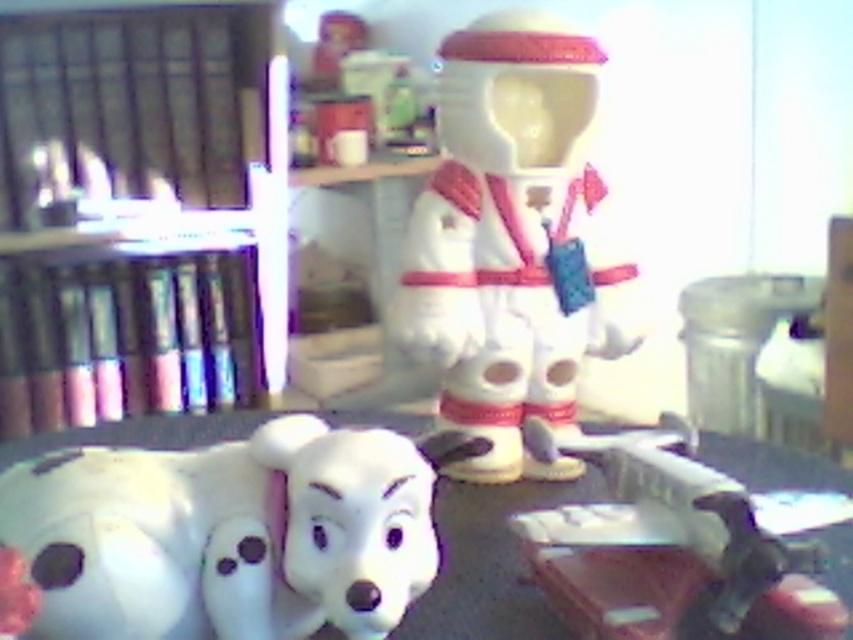
Who is positioned more to the right, metallic black bookshelf at left or white glossy astronaut at center?

white glossy astronaut at center

Between point (19, 216) and point (541, 176), which one is positioned behind?

The point (19, 216) is more distant.

Locate an element on the screen. This screenshot has height=640, width=853. metallic black bookshelf at left is located at coordinates (140, 211).

Does metallic black bookshelf at left appear on the left side of white plastic table at lower center?

Yes, metallic black bookshelf at left is to the left of white plastic table at lower center.

Can you confirm if metallic black bookshelf at left is wider than white plastic table at lower center?

No, metallic black bookshelf at left is not wider than white plastic table at lower center.

Image resolution: width=853 pixels, height=640 pixels. Describe the element at coordinates (140, 211) in the screenshot. I see `metallic black bookshelf at left` at that location.

I want to click on metallic black bookshelf at left, so click(x=140, y=211).

Which of these two, white glossy astronaut at center or white plastic table at lower center, stands shorter?

→ With less height is white plastic table at lower center.

Identify the location of white glossy astronaut at center. The width and height of the screenshot is (853, 640). (514, 243).

You are a GUI agent. You are given a task and a screenshot of the screen. Output one action in this format:
    pyautogui.click(x=<x>, y=<y>)
    Task: Click on the white glossy astronaut at center
    The width and height of the screenshot is (853, 640).
    Given the screenshot: What is the action you would take?
    pyautogui.click(x=514, y=243)